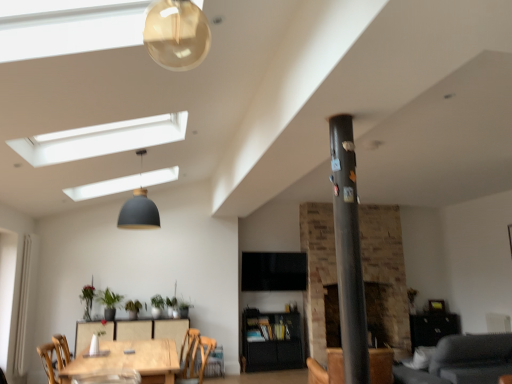
What do you see at coordinates (133, 306) in the screenshot? The image size is (512, 384). I see `green leafy plant at center, which ranks as the second plant in right-to-left order` at bounding box center [133, 306].

The image size is (512, 384). What do you see at coordinates (139, 212) in the screenshot?
I see `matte black pendant lamp at upper center` at bounding box center [139, 212].

At what (x,y) coordinates should I click in order to perform the action: click on gray fabric couch at lower right. Please return your answer as a coordinate pair (x, y). This screenshot has height=384, width=512. Looking at the image, I should click on (463, 361).

Describe the element at coordinates (151, 330) in the screenshot. I see `wooden table at center, marked as the second table in a front-to-back arrangement` at that location.

I want to click on wooden table at center, acting as the 1th table starting from the back, so pos(151,330).

Where is `green matte plant at center, acting as the first plant starting from the right`? The height and width of the screenshot is (384, 512). green matte plant at center, acting as the first plant starting from the right is located at coordinates (157, 302).

The image size is (512, 384). I want to click on green leafy plant at center, which ranks as the second plant in right-to-left order, so click(133, 306).

Does wooden table at center, which appears as the second table when viewed from the back, appear on the right side of metallic gray pole at center?

No.

Between wooden table at center, which appears as the second table when viewed from the back, and metallic gray pole at center, which one has larger size?

wooden table at center, which appears as the second table when viewed from the back.

Considering their positions, is wooden table at center, which appears as the second table when viewed from the back, located in front of or behind metallic gray pole at center?

wooden table at center, which appears as the second table when viewed from the back, is positioned farther from the viewer than metallic gray pole at center.

From a real-world perspective, is black matte cabinet at center over green matte plant at lower left, acting as the 3th plant starting from the right?

No, from a real-world perspective, black matte cabinet at center is not on top of green matte plant at lower left, acting as the 3th plant starting from the right.

From the image's perspective, is black matte cabinet at center on top of green matte plant at lower left, positioned as the second plant in left-to-right order?

No, from the image's perspective, black matte cabinet at center is not above green matte plant at lower left, positioned as the second plant in left-to-right order.

Looking at this image, does black matte cabinet at center appear on the right side of green matte plant at lower left, positioned as the second plant in left-to-right order?

Indeed, black matte cabinet at center is positioned on the right side of green matte plant at lower left, positioned as the second plant in left-to-right order.

Is point (295, 339) in front of point (115, 304)?

No.

From the picture: Could you tell me if matte black pendant lamp at upper center is turned towards wooden table at center, which appears as the second table when viewed from the back?

No, matte black pendant lamp at upper center is not facing towards wooden table at center, which appears as the second table when viewed from the back.

Considering the relative sizes of matte black pendant lamp at upper center and wooden table at center, positioned as the 1th table in front-to-back order, in the image provided, is matte black pendant lamp at upper center bigger than wooden table at center, positioned as the 1th table in front-to-back order,?

Actually, matte black pendant lamp at upper center might be smaller than wooden table at center, positioned as the 1th table in front-to-back order.

Does matte black pendant lamp at upper center have a greater width compared to wooden table at center, which appears as the second table when viewed from the back?

No.

At what (x,y) coordinates should I click in order to perform the action: click on the 1st table positioned below the matte black pendant lamp at upper center (from the image's perspective). Please return your answer as a coordinate pair (x, y). This screenshot has height=384, width=512. Looking at the image, I should click on (130, 361).

Is black matte cabinet at center not near gray fabric couch at lower right?

Yes.

Can you confirm if black matte cabinet at center is positioned to the right of gray fabric couch at lower right?

No, black matte cabinet at center is not to the right of gray fabric couch at lower right.

Would you say black matte cabinet at center is outside gray fabric couch at lower right?

black matte cabinet at center lies outside gray fabric couch at lower right's area.

Does green matte plant at lower left, acting as the 3th plant starting from the right, appear on the right side of green matte plant at lower left, the fourth plant viewed from the right?

Indeed, green matte plant at lower left, acting as the 3th plant starting from the right, is positioned on the right side of green matte plant at lower left, the fourth plant viewed from the right.

In the scene shown: Is green matte plant at lower left, placed as the 1th plant when sorted from left to right, inside green matte plant at lower left, acting as the 3th plant starting from the right?

No, green matte plant at lower left, placed as the 1th plant when sorted from left to right, is not inside green matte plant at lower left, acting as the 3th plant starting from the right.

Is green matte plant at lower left, acting as the 3th plant starting from the right, turned away from green matte plant at lower left, the fourth plant viewed from the right?

green matte plant at lower left, acting as the 3th plant starting from the right, is not turned away from green matte plant at lower left, the fourth plant viewed from the right.

What's the angular difference between green matte plant at lower left, positioned as the second plant in left-to-right order, and green matte plant at lower left, the fourth plant viewed from the right,'s facing directions?

A: 2.99 degrees.

In terms of height, does wooden chair at lower center look taller or shorter compared to green leafy plant at center, the third plant viewed from the left?

Considering their sizes, wooden chair at lower center has more height than green leafy plant at center, the third plant viewed from the left.

Measure the distance from wooden chair at lower center to green leafy plant at center, which ranks as the second plant in right-to-left order.

1.30 meters.

Is wooden chair at lower center positioned with its back to green leafy plant at center, which ranks as the second plant in right-to-left order?

wooden chair at lower center does not have its back to green leafy plant at center, which ranks as the second plant in right-to-left order.

Considering the positions of point (202, 378) and point (130, 305), is point (202, 378) closer or farther from the camera than point (130, 305)?

Point (202, 378) is positioned closer to the camera compared to point (130, 305).

How different are the orientations of black matte cabinet at center and green matte plant at lower left, placed as the 1th plant when sorted from left to right, in degrees?

The angle between the facing direction of black matte cabinet at center and the facing direction of green matte plant at lower left, placed as the 1th plant when sorted from left to right, is 3.49 degrees.

At what (x,y) coordinates should I click in order to perform the action: click on plant that is the 3rd one above the black matte cabinet at center (from a real-world perspective). Please return your answer as a coordinate pair (x, y). Image resolution: width=512 pixels, height=384 pixels. Looking at the image, I should click on (87, 300).

Which of these two, black matte cabinet at center or green matte plant at lower left, placed as the 1th plant when sorted from left to right, is bigger?

With larger size is black matte cabinet at center.

Does black matte cabinet at center have a greater height compared to green matte plant at lower left, placed as the 1th plant when sorted from left to right?

Correct, black matte cabinet at center is much taller as green matte plant at lower left, placed as the 1th plant when sorted from left to right.

Identify the location of pillar that is on the right side of wooden table at center, positioned as the 1th table in front-to-back order. The width and height of the screenshot is (512, 384). (348, 251).

Where is `cabinetry below the green matte plant at lower left, acting as the 3th plant starting from the right (from the image's perspective)`? cabinetry below the green matte plant at lower left, acting as the 3th plant starting from the right (from the image's perspective) is located at coordinates (271, 341).

Estimate the real-world distances between objects in this image. Which object is closer to wooden table at center, positioned as the 1th table in front-to-back order, green leafy plant at center, which ranks as the second plant in right-to-left order, or black matte cabinet at center?

Based on the image, green leafy plant at center, which ranks as the second plant in right-to-left order, appears to be nearer to wooden table at center, positioned as the 1th table in front-to-back order.

Looking at this image, which object lies further to the anchor point brown leather armchair at center, metallic gray pole at center or wooden table at center, acting as the 1th table starting from the back?

metallic gray pole at center is positioned further to the anchor brown leather armchair at center.

When comparing their distances from green matte plant at center, the 4th plant from the left, does gray fabric couch at lower right or green matte plant at lower left, the fourth plant viewed from the right, seem further?

gray fabric couch at lower right.

Considering their positions, is brown leather armchair at center positioned closer to gray fabric couch at lower right than green matte plant at lower left, acting as the 3th plant starting from the right?

Among the two, brown leather armchair at center is located nearer to gray fabric couch at lower right.

Considering their positions, is gray fabric couch at lower right positioned closer to green matte plant at lower left, positioned as the second plant in left-to-right order, than brown leather armchair at center?

Among the two, brown leather armchair at center is located nearer to green matte plant at lower left, positioned as the second plant in left-to-right order.

Considering their positions, is green matte plant at lower left, placed as the 1th plant when sorted from left to right, positioned closer to green matte plant at lower left, positioned as the second plant in left-to-right order, than green matte plant at center, acting as the first plant starting from the right?

The object closer to green matte plant at lower left, positioned as the second plant in left-to-right order, is green matte plant at lower left, placed as the 1th plant when sorted from left to right.

Looking at this image, looking at the image, which one is located closer to wooden table at center, which appears as the second table when viewed from the back, green matte plant at lower left, placed as the 1th plant when sorted from left to right, or brown leather armchair at center?

The object closer to wooden table at center, which appears as the second table when viewed from the back, is green matte plant at lower left, placed as the 1th plant when sorted from left to right.

Looking at the image, which one is located closer to green matte plant at lower left, the fourth plant viewed from the right, wooden chair at lower center or brown leather armchair at center?

Among the two, wooden chair at lower center is located nearer to green matte plant at lower left, the fourth plant viewed from the right.

Locate an element on the screen. pillar between wooden chair at lower center and gray fabric couch at lower right in the horizontal direction is located at coordinates (348, 251).

Locate an element on the screen. Image resolution: width=512 pixels, height=384 pixels. armchair between gray fabric couch at lower right and black matte cabinet at center in the front-back direction is located at coordinates tap(327, 368).

Image resolution: width=512 pixels, height=384 pixels. I want to click on light fixture positioned between wooden chair at lower center and green matte plant at lower left, positioned as the second plant in left-to-right order, from near to far, so click(139, 212).

This screenshot has height=384, width=512. Find the location of `plant between green leafy plant at center, which ranks as the second plant in right-to-left order, and black matte cabinet at center from left to right`. plant between green leafy plant at center, which ranks as the second plant in right-to-left order, and black matte cabinet at center from left to right is located at coordinates (157, 302).